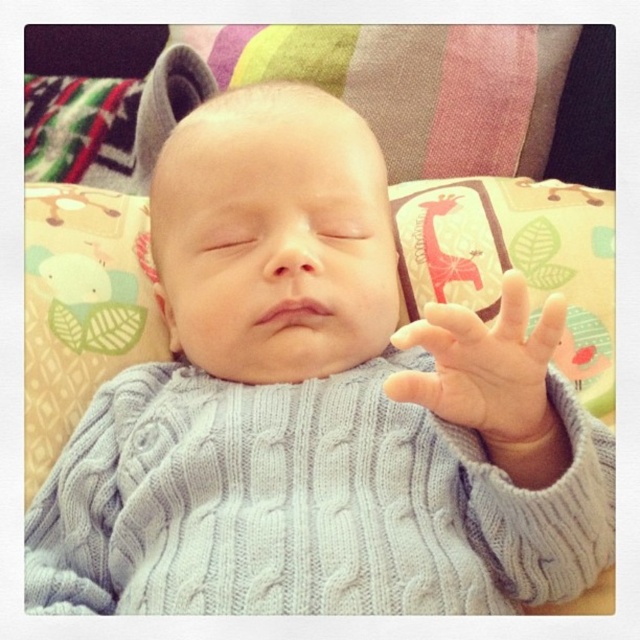
Can you confirm if cable-knit sweater at center is shorter than white knitted hand at center?

No.

Is cable-knit sweater at center to the left of white knitted hand at center from the viewer's perspective?

Yes, cable-knit sweater at center is to the left of white knitted hand at center.

Find the location of `cable-knit sweater at center`. cable-knit sweater at center is located at coordinates (273, 236).